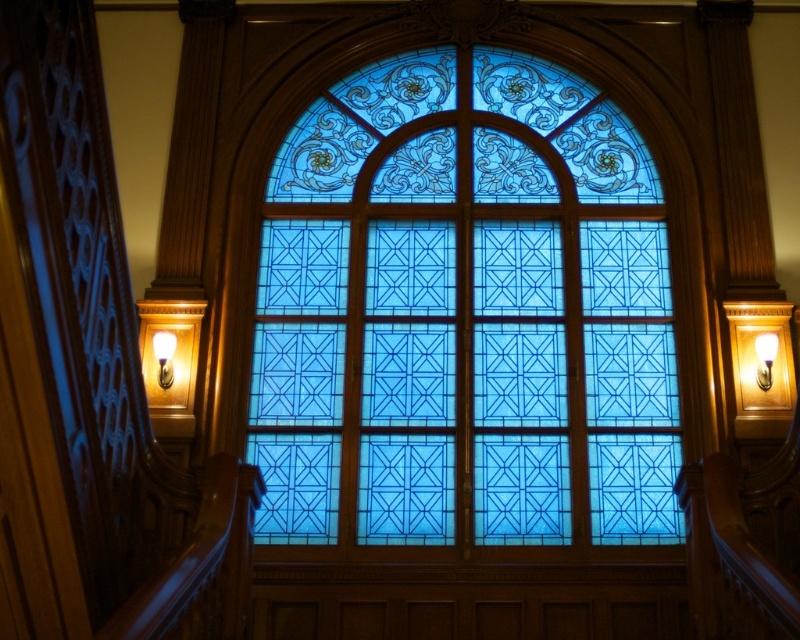
You are a tour guide leading a group through this historic building. You want to ensure visitors can comfortably view both the blue stained glass at center and the wooden handrail at left from a single vantage point. Given that the average comfortable viewing distance for such features is around 25 meters, can visitors stand at a spot where both are within this range?

The distance between the blue stained glass at center and the wooden handrail at left is 25.95 meters. Since the comfortable viewing distance is approximately 25 meters, visitors would need to position themselves slightly closer to stay within the recommended range for both objects.

Based on the photo, you are an interior designer assessing the space. You need to determine which object, the wooden handrail at left or the white glossy wall sconce at upper center, requires more materials for fabrication. Based on the scene, which one would that be?

The wooden handrail at left is bigger than the white glossy wall sconce at upper center, so the wooden handrail at left would require more materials for fabrication.

You are a visitor standing in the grand hall and want to touch both the wooden handrail at left and the white glossy wall sconce at upper center. Which object do you need to reach higher to touch?

The wooden handrail at left is above the white glossy wall sconce at upper center, so you need to reach higher to touch the wooden handrail at left.